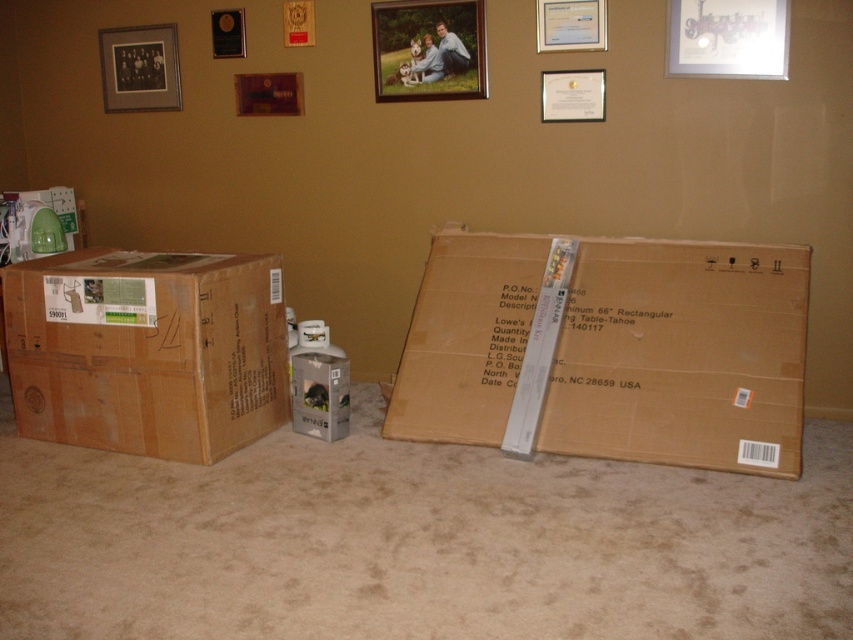
Question: Does wooden picture frame at upper center appear on the left side of matte white certificate at upper center?

Choices:
 (A) yes
 (B) no

Answer: (A)

Question: Does brown cardboard box at left have a smaller size compared to metallic silver picture frame at upper right?

Choices:
 (A) no
 (B) yes

Answer: (A)

Question: Which of the following is the farthest from the observer?

Choices:
 (A) (316, 358)
 (B) (405, 48)
 (C) (161, 58)

Answer: (C)

Question: Can you confirm if metallic silver picture frame at upper right is wider than matte white certificate at upper center?

Choices:
 (A) yes
 (B) no

Answer: (A)

Question: Among these points, which one is nearest to the camera?

Choices:
 (A) (546, 102)
 (B) (283, 109)
 (C) (567, 20)
 (D) (215, 29)

Answer: (C)

Question: Which point appears farthest from the camera in this image?

Choices:
 (A) click(554, 81)
 (B) click(230, 52)

Answer: (B)